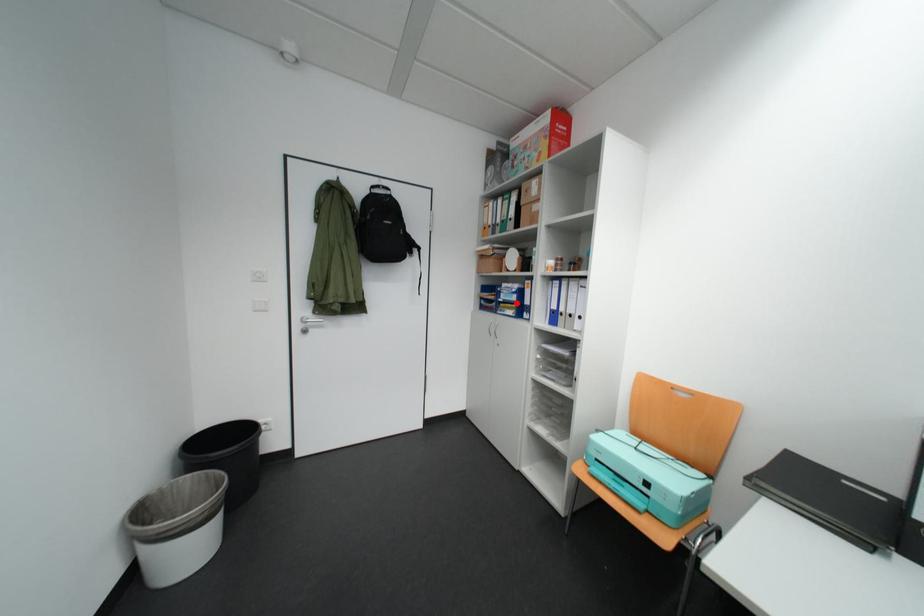
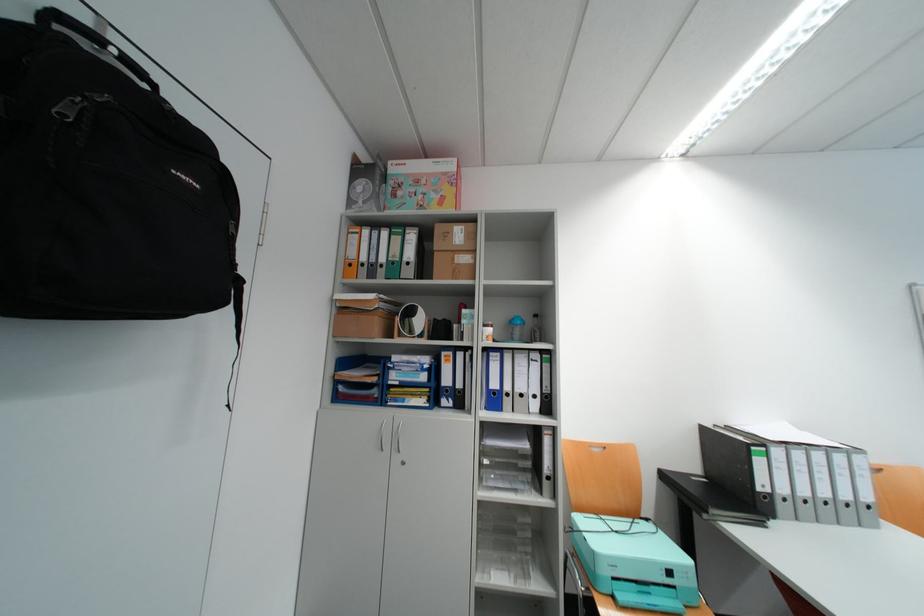
In the second image, find the point that corresponds to the highlighted location in the first image.

(415, 387)